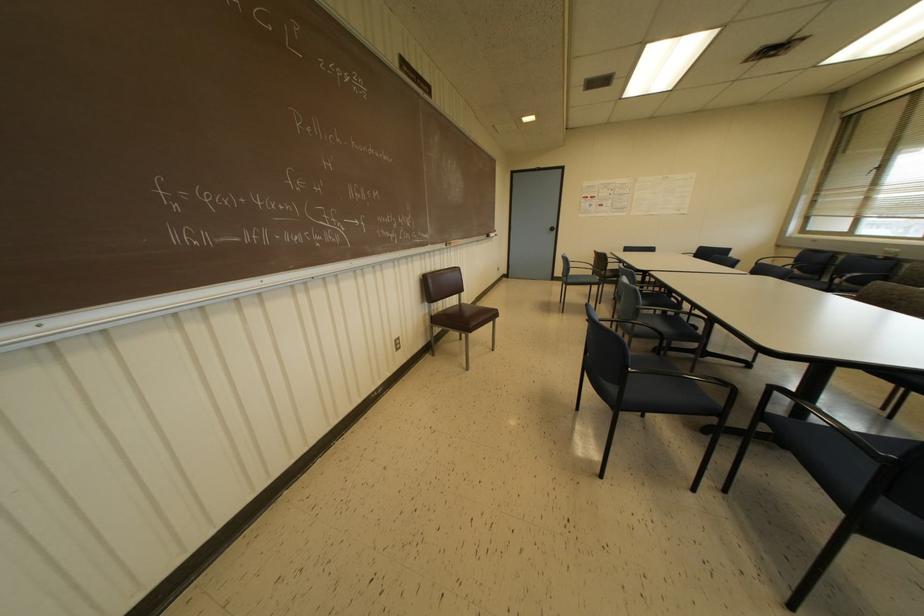
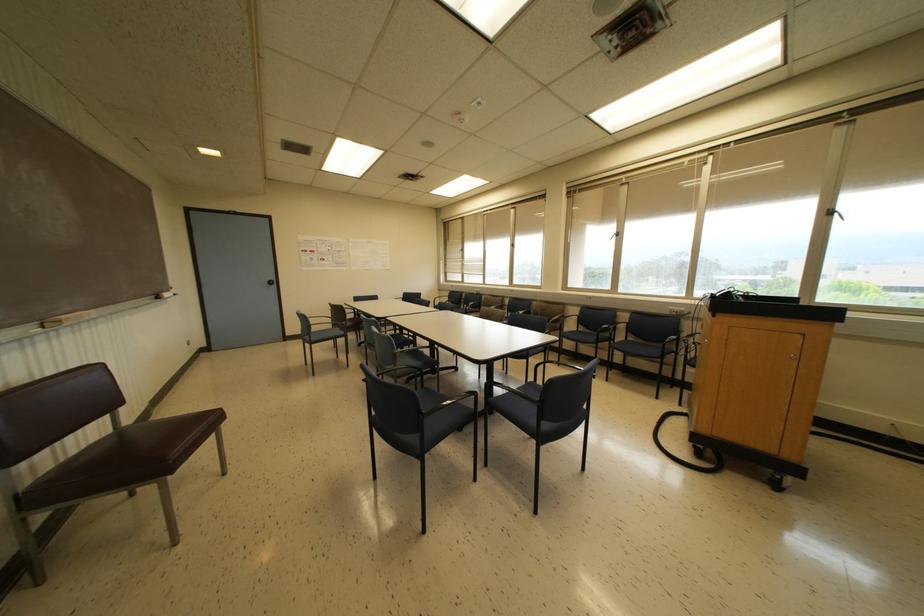
Locate, in the second image, the point that corresponds to (x=638, y=310) in the first image.

(394, 354)